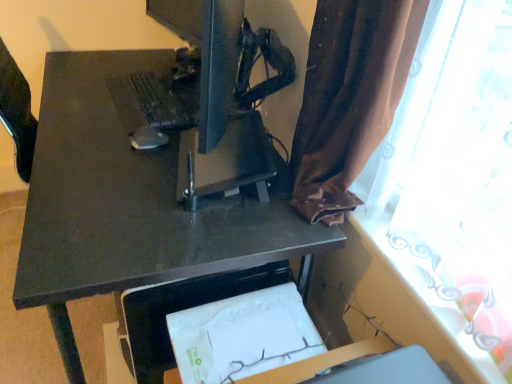
Question: Does brown fabric curtain at upper right have a greater height compared to matte black mouse at center?

Choices:
 (A) yes
 (B) no

Answer: (A)

Question: From a real-world perspective, is brown fabric curtain at upper right beneath matte black mouse at center?

Choices:
 (A) no
 (B) yes

Answer: (B)

Question: Does brown fabric curtain at upper right have a lesser width compared to matte black mouse at center?

Choices:
 (A) yes
 (B) no

Answer: (A)

Question: Is brown fabric curtain at upper right positioned far away from matte black mouse at center?

Choices:
 (A) no
 (B) yes

Answer: (A)

Question: Could you tell me if brown fabric curtain at upper right is turned towards matte black mouse at center?

Choices:
 (A) yes
 (B) no

Answer: (A)

Question: Is brown fabric curtain at upper right directly adjacent to matte black mouse at center?

Choices:
 (A) yes
 (B) no

Answer: (B)

Question: Is matte black monitor at center at the right side of matte black desk at center?

Choices:
 (A) yes
 (B) no

Answer: (A)

Question: Is matte black monitor at center further to the viewer compared to matte black desk at center?

Choices:
 (A) yes
 (B) no

Answer: (B)

Question: Can you confirm if matte black monitor at center is thinner than matte black desk at center?

Choices:
 (A) no
 (B) yes

Answer: (B)

Question: From a real-world perspective, is matte black monitor at center located higher than matte black desk at center?

Choices:
 (A) no
 (B) yes

Answer: (B)

Question: Is matte black monitor at center taller than matte black desk at center?

Choices:
 (A) yes
 (B) no

Answer: (B)

Question: Is matte black monitor at center looking in the opposite direction of matte black desk at center?

Choices:
 (A) no
 (B) yes

Answer: (A)

Question: Is matte black monitor at center facing away from matte black keyboard at upper left?

Choices:
 (A) yes
 (B) no

Answer: (B)